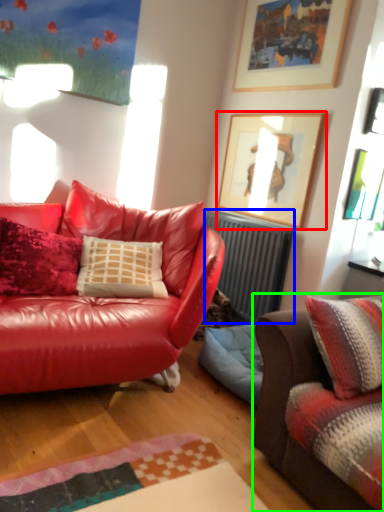
Question: Which is farther away from picture frame (highlighted by a red box)? radiator (highlighted by a blue box) or studio couch (highlighted by a green box)?

Choices:
 (A) radiator
 (B) studio couch

Answer: (B)